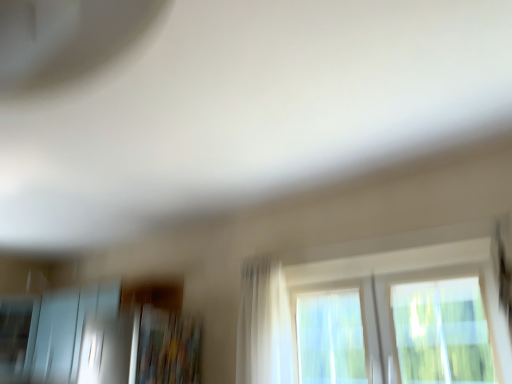
Locate an element on the screen. The image size is (512, 384). frosted glass screen door at lower left is located at coordinates (67, 329).

Locate an element on the screen. frosted glass screen door at lower left is located at coordinates (67, 329).

In the scene shown: Which point is more forward, (45, 306) or (257, 291)?

→ Point (257, 291)

Is frosted glass screen door at lower left in front of or behind white sheer curtain at center in the image?

Clearly, frosted glass screen door at lower left is behind white sheer curtain at center.

From the image's perspective, does frosted glass screen door at lower left appear lower than white sheer curtain at center?

Yes, from the image's perspective, frosted glass screen door at lower left is below white sheer curtain at center.

From their relative heights in the image, would you say frosted glass screen door at lower left is taller or shorter than white sheer curtain at center?

frosted glass screen door at lower left is shorter than white sheer curtain at center.

Looking at this image, based on their sizes in the image, would you say transparent glass window at center is bigger or smaller than white sheer curtain at center?

In the image, transparent glass window at center appears to be larger than white sheer curtain at center.

Is the depth of transparent glass window at center less than that of white sheer curtain at center?

Yes, transparent glass window at center is closer to the viewer.

Between transparent glass window at center and white sheer curtain at center, which one has more height?

white sheer curtain at center is taller.

Is frosted glass screen door at lower left aimed at transparent glass window at center?

No, frosted glass screen door at lower left is not turned towards transparent glass window at center.

In terms of height, does frosted glass screen door at lower left look taller or shorter compared to transparent glass window at center?

Clearly, frosted glass screen door at lower left is taller compared to transparent glass window at center.

Would you consider frosted glass screen door at lower left to be distant from transparent glass window at center?

Yes, frosted glass screen door at lower left and transparent glass window at center are quite far apart.

Between frosted glass screen door at lower left and transparent glass window at center, which one has larger size?

frosted glass screen door at lower left.

Is white sheer curtain at center positioned beyond the bounds of transparent glass window at center?

Absolutely, white sheer curtain at center is external to transparent glass window at center.

Identify the location of curtain above the transparent glass window at center (from the image's perspective). This screenshot has height=384, width=512. (264, 325).

Between white sheer curtain at center and transparent glass window at center, which one has larger size?

With larger size is transparent glass window at center.

In terms of height, does white sheer curtain at center look taller or shorter compared to transparent glass window at center?

In the image, white sheer curtain at center appears to be taller than transparent glass window at center.

Does point (271, 352) lie in front of point (35, 377)?

Yes, point (271, 352) is in front of point (35, 377).

Is white sheer curtain at center next to frosted glass screen door at lower left and touching it?

No, white sheer curtain at center is not next to frosted glass screen door at lower left.

Can you confirm if white sheer curtain at center is positioned to the left of frosted glass screen door at lower left?

No, white sheer curtain at center is not to the left of frosted glass screen door at lower left.

Can you tell me how much transparent glass window at center and frosted glass screen door at lower left differ in facing direction?

The angular difference between transparent glass window at center and frosted glass screen door at lower left is 0.289 degrees.

Is transparent glass window at center spatially inside frosted glass screen door at lower left, or outside of it?

transparent glass window at center is not enclosed by frosted glass screen door at lower left.

Is transparent glass window at center smaller than frosted glass screen door at lower left?

Yes.

From the picture: Does transparent glass window at center turn towards frosted glass screen door at lower left?

No, transparent glass window at center is not facing towards frosted glass screen door at lower left.

Locate an element on the screen. The height and width of the screenshot is (384, 512). screen door that is under the white sheer curtain at center (from a real-world perspective) is located at coordinates (67, 329).

You are a GUI agent. You are given a task and a screenshot of the screen. Output one action in this format:
    pyautogui.click(x=<x>, y=<y>)
    Task: Click on the window lying below the white sheer curtain at center (from the image's perspective)
    The image size is (512, 384).
    Given the screenshot: What is the action you would take?
    pyautogui.click(x=385, y=311)

From the image, which object appears to be nearer to transparent glass window at center, white sheer curtain at center or frosted glass screen door at lower left?

The object closer to transparent glass window at center is white sheer curtain at center.

Based on their spatial positions, is frosted glass screen door at lower left or white sheer curtain at center further from transparent glass window at center?

frosted glass screen door at lower left lies further to transparent glass window at center than the other object.

From the image, which object appears to be nearer to frosted glass screen door at lower left, transparent glass window at center or white sheer curtain at center?

white sheer curtain at center.

Based on their spatial positions, is white sheer curtain at center or transparent glass window at center further from frosted glass screen door at lower left?

Based on the image, transparent glass window at center appears to be further to frosted glass screen door at lower left.

Considering their positions, is transparent glass window at center positioned further to white sheer curtain at center than frosted glass screen door at lower left?

Based on the image, frosted glass screen door at lower left appears to be further to white sheer curtain at center.

Estimate the real-world distances between objects in this image. Which object is further from white sheer curtain at center, frosted glass screen door at lower left or transparent glass window at center?

Among the two, frosted glass screen door at lower left is located further to white sheer curtain at center.

This screenshot has height=384, width=512. What are the coordinates of `curtain located between frosted glass screen door at lower left and transparent glass window at center in the left-right direction` in the screenshot? It's located at (264, 325).